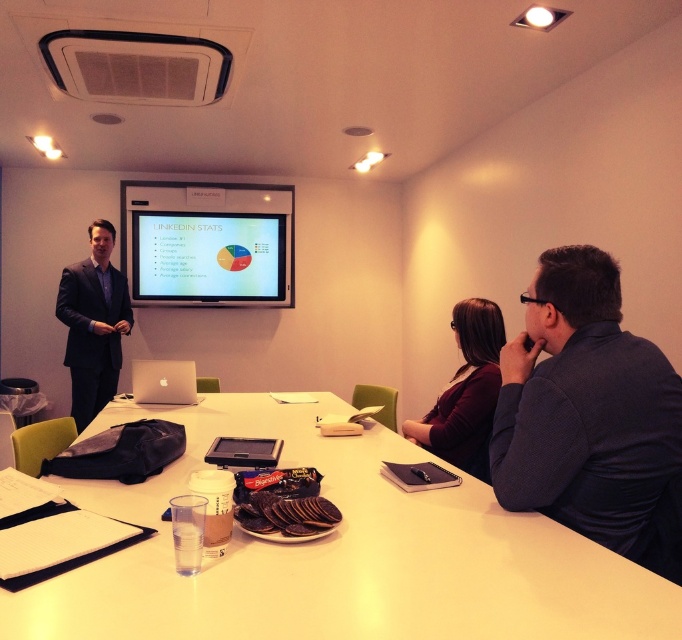
Question: From the image, what is the correct spatial relationship of white glossy table at center in relation to dark grey sweater at right?

Choices:
 (A) right
 (B) left

Answer: (B)

Question: Which point is closer to the camera taking this photo?

Choices:
 (A) (140, 234)
 (B) (584, 413)
 (C) (473, 403)

Answer: (B)

Question: Can you confirm if white glossy table at center is positioned to the right of maroon fabric jacket at center?

Choices:
 (A) yes
 (B) no

Answer: (B)

Question: Does white glossy table at center come in front of dark blue suit at left?

Choices:
 (A) yes
 (B) no

Answer: (A)

Question: Which point appears farthest from the camera in this image?

Choices:
 (A) (207, 257)
 (B) (522, 340)
 (C) (78, 316)

Answer: (A)

Question: Which point is farther to the camera?

Choices:
 (A) 464,403
 (B) 177,403
 (C) 518,557
 (D) 183,275

Answer: (D)